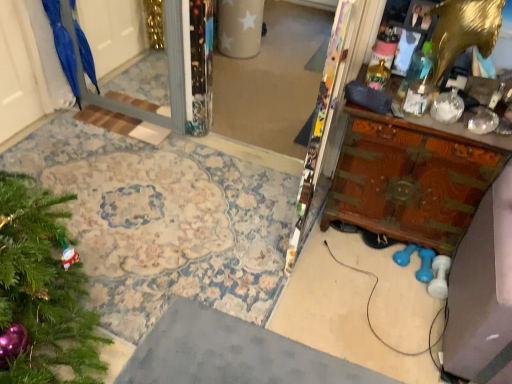
You are a GUI agent. You are given a task and a screenshot of the screen. Output one action in this format:
    pyautogui.click(x=<x>, y=<y>)
    Task: Click on the blue matte umbrella at left
    
    Given the screenshot: What is the action you would take?
    pyautogui.click(x=63, y=46)

Describe the element at coordinates (63, 46) in the screenshot. I see `blue matte umbrella at left` at that location.

Consider the image. What is the approximate width of wooden carved vanity at right?

wooden carved vanity at right is 16.31 inches in width.

What do you see at coordinates (412, 177) in the screenshot?
I see `wooden carved vanity at right` at bounding box center [412, 177].

The width and height of the screenshot is (512, 384). I want to click on wooden carved vanity at right, so click(x=412, y=177).

Locate an element on the screen. blue matte umbrella at left is located at coordinates (63, 46).

Is blue matte umbrella at left to the left of wooden carved vanity at right from the viewer's perspective?

Indeed, blue matte umbrella at left is positioned on the left side of wooden carved vanity at right.

Relative to wooden carved vanity at right, is blue matte umbrella at left in front or behind?

blue matte umbrella at left is behind wooden carved vanity at right.

Does point (81, 40) come in front of point (351, 160)?

No, it is behind (351, 160).

From the image's perspective, is blue matte umbrella at left below wooden carved vanity at right?

No, from the image's perspective, blue matte umbrella at left is not beneath wooden carved vanity at right.

From a real-world perspective, is blue matte umbrella at left beneath wooden carved vanity at right?

No, from a real-world perspective, blue matte umbrella at left is not beneath wooden carved vanity at right.

Between blue matte umbrella at left and wooden carved vanity at right, which one has larger width?

wooden carved vanity at right.

Who is taller, blue matte umbrella at left or wooden carved vanity at right?

wooden carved vanity at right is taller.

Considering the sizes of objects blue matte umbrella at left and wooden carved vanity at right in the image provided, who is smaller, blue matte umbrella at left or wooden carved vanity at right?

With smaller size is blue matte umbrella at left.

Which is correct: blue matte umbrella at left is inside wooden carved vanity at right, or outside of it?

blue matte umbrella at left cannot be found inside wooden carved vanity at right.

Is blue matte umbrella at left with wooden carved vanity at right?

blue matte umbrella at left and wooden carved vanity at right are not in contact.

Is blue matte umbrella at left looking in the opposite direction of wooden carved vanity at right?

That's not correct — blue matte umbrella at left is not looking away from wooden carved vanity at right.

How different are the orientations of blue matte umbrella at left and wooden carved vanity at right in degrees?

blue matte umbrella at left and wooden carved vanity at right are facing 2.15 degrees away from each other.

Consider the image. How far apart are blue matte umbrella at left and wooden carved vanity at right?

blue matte umbrella at left is 1.94 meters away from wooden carved vanity at right.

Find the location of a particular element. The height and width of the screenshot is (384, 512). parrot located on the left of wooden carved vanity at right is located at coordinates (63, 46).

Is wooden carved vanity at right to the left or to the right of blue matte umbrella at left in the image?

Clearly, wooden carved vanity at right is on the right of blue matte umbrella at left in the image.

Relative to blue matte umbrella at left, is wooden carved vanity at right in front or behind?

In the image, wooden carved vanity at right appears in front of blue matte umbrella at left.

Does point (360, 154) appear closer or farther from the camera than point (69, 60)?

Clearly, point (360, 154) is closer to the camera than point (69, 60).

From the image's perspective, is wooden carved vanity at right located above or below blue matte umbrella at left?

Clearly, from the image's perspective, wooden carved vanity at right is below blue matte umbrella at left.

From a real-world perspective, between wooden carved vanity at right and blue matte umbrella at left, who is vertically higher?

In real-world perspective, blue matte umbrella at left is above.

Considering the sizes of wooden carved vanity at right and blue matte umbrella at left in the image, is wooden carved vanity at right wider or thinner than blue matte umbrella at left?

Considering their sizes, wooden carved vanity at right looks broader than blue matte umbrella at left.

Is wooden carved vanity at right shorter than blue matte umbrella at left?

No, wooden carved vanity at right is not shorter than blue matte umbrella at left.

Consider the image. Considering the sizes of objects wooden carved vanity at right and blue matte umbrella at left in the image provided, who is smaller, wooden carved vanity at right or blue matte umbrella at left?

Smaller between the two is blue matte umbrella at left.

Is wooden carved vanity at right inside the boundaries of blue matte umbrella at left, or outside?

wooden carved vanity at right is not inside blue matte umbrella at left, it's outside.

Is wooden carved vanity at right not close to blue matte umbrella at left?

wooden carved vanity at right is positioned a significant distance from blue matte umbrella at left.

Is wooden carved vanity at right positioned with its back to blue matte umbrella at left?

No, wooden carved vanity at right's orientation is not away from blue matte umbrella at left.

Can you tell me how much wooden carved vanity at right and blue matte umbrella at left differ in facing direction?

They differ by 2.15 degrees in their facing directions.

At what (x,y) coordinates should I click in order to perform the action: click on vanity beneath the blue matte umbrella at left (from a real-world perspective). Please return your answer as a coordinate pair (x, y). The image size is (512, 384). Looking at the image, I should click on pyautogui.click(x=412, y=177).

Locate an element on the screen. This screenshot has width=512, height=384. parrot above the wooden carved vanity at right (from the image's perspective) is located at coordinates (63, 46).

In the image, there is a blue matte umbrella at left. At what (x,y) coordinates should I click in order to perform the action: click on vanity below it (from the image's perspective). Please return your answer as a coordinate pair (x, y). Looking at the image, I should click on (412, 177).